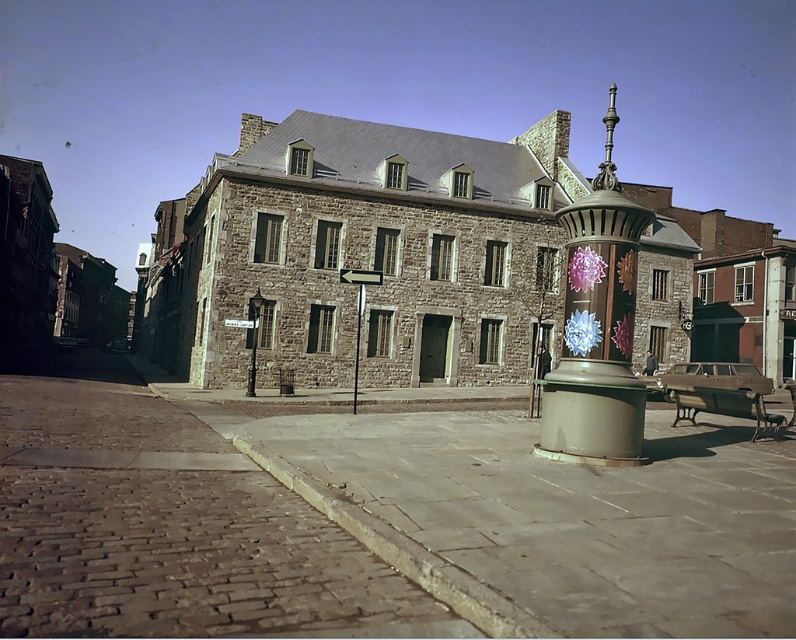
You are standing on the curved cobblestone street leading up to the large stone building. You see two points marked on the ground. One is at point (267,456) and the other at point (135,538). Which point is closer to you?

Point (267,456) is closer to you because it is further to the viewer than point (135,538).

You are a delivery person trying to park your 1.2 meter wide cart on the smooth concrete pavement at center and brown cobblestone pavement at lower left. Which pavement can accommodate your cart without overhanging?

The smooth concrete pavement at center is not as tall as brown cobblestone pavement at lower left, but the question is about width. Since the cart is 1.2 meters wide, both pavements can accommodate it unless their widths are specified. However, the description only mentions height, so we can assume both are wide enough. Therefore, either pavement can fit the cart.

You are a delivery person trying to place a large package on the ground near the smooth concrete pavement at center and the metallic gold trash can at center. Which object allows you to place the package higher off the ground?

The metallic gold trash can at center allows placing the package higher off the ground because it is taller than the smooth concrete pavement at center.